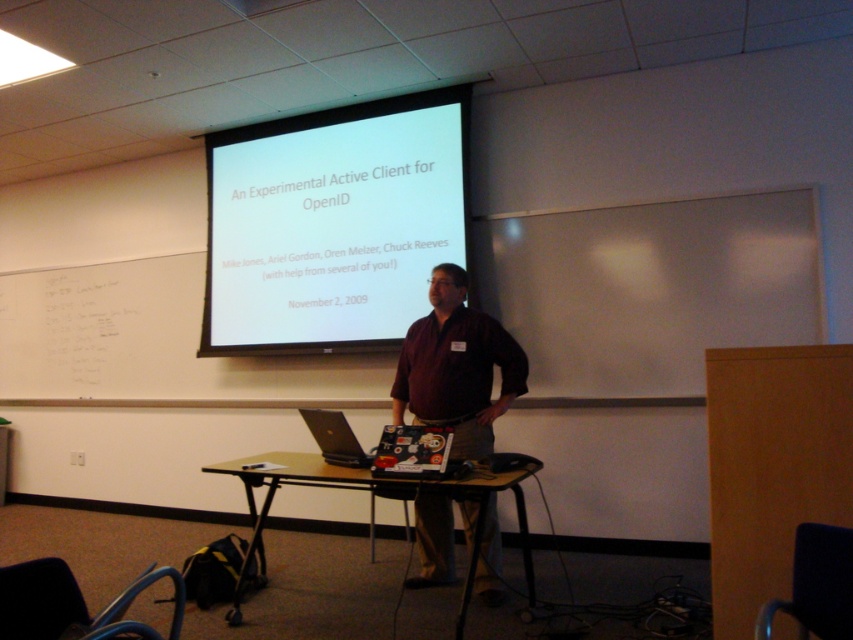
Consider the image. You are a photographer standing in front of the classroom. You need to take a photo that includes both the brown matte shirt at center and the silver metallic laptop at center. Which object should you focus on first if you want to ensure both are in the frame?

The brown matte shirt at center has a larger width than the silver metallic laptop at center, so you should focus on the brown matte shirt at center first to ensure both fit within the frame.

You are a student in the classroom and want to place a notebook on the brown wooden table at center without getting too close to the brown matte shirt at center. Can you fit the notebook on the table while maintaining a distance of at least 15 inches from the shirt?

The brown matte shirt at center and brown wooden table at center are 17.76 inches apart. Since the required distance is 15 inches, the notebook can be placed on the brown wooden table at center while keeping at least 15 inches away from the brown matte shirt at center.

You are a student in the classroom and you want to hand in a paper to the person wearing the brown matte shirt at center. Your pencil case is on the silver metallic laptop at center. Can you reach the person without moving the pencil case?

The distance between the brown matte shirt at center and the silver metallic laptop at center is 23.53 inches. Since the pencil case is on the laptop, you can reach the person by extending your arm without moving the pencil case as the distance is within typical arm reach.